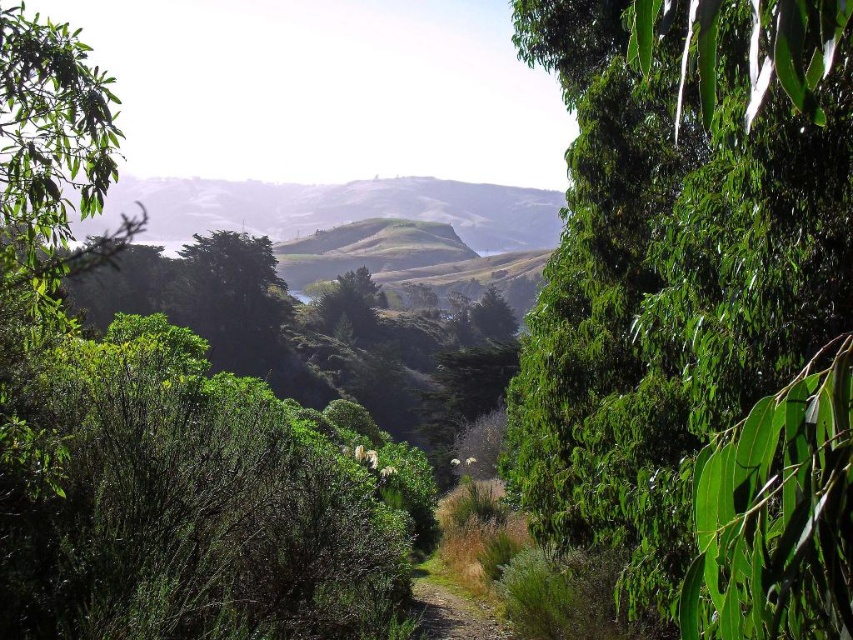
You are standing at the starting point of the dirt path in the foreground. You want to reach the green leafy tree at center. Which direction should you walk to get there?

The green leafy tree at center is located at coordinates point [666,285], so you should walk towards the center of the image to reach it.

You are a hiker planning to walk along the gravel path at center. There is a green leafy tree at left nearby. Do you think the tree is wider than the path?

The green leafy tree at left might be wider than gravel path at center, so there is a possibility that the tree is wider than the path.